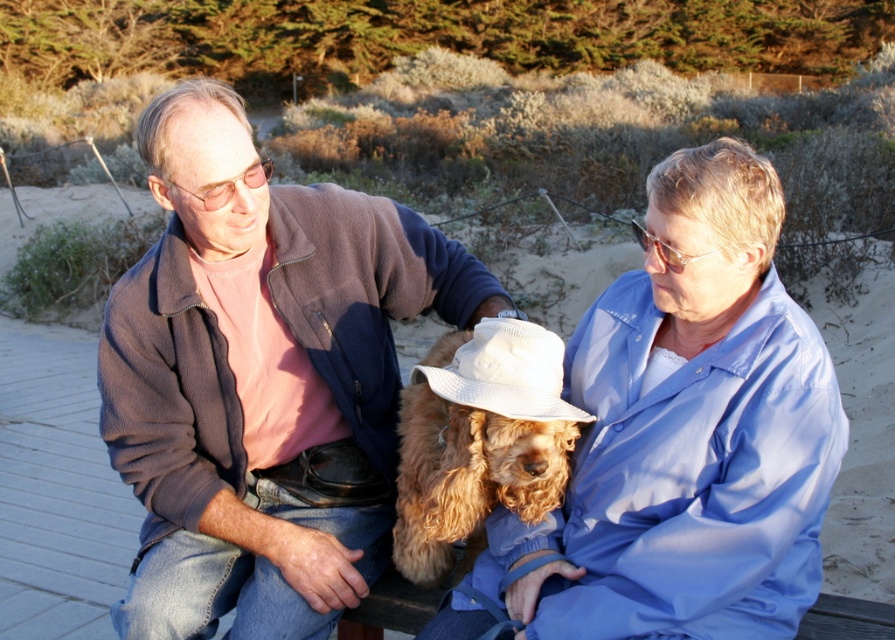
Between point (636, 346) and point (489, 499), which one is positioned in front?

Point (636, 346) is more forward.

Does light blue fabric shirt at center come in front of fuzzy brown dog at center?

Yes, it is in front of fuzzy brown dog at center.

Does point (632, 541) lie in front of point (542, 451)?

No, (632, 541) is behind (542, 451).

I want to click on light blue fabric shirt at center, so click(x=687, y=433).

Who is positioned more to the left, matte brown jacket at left or fuzzy brown dog at center?

From the viewer's perspective, matte brown jacket at left appears more on the left side.

Consider the image. Does matte brown jacket at left have a greater width compared to fuzzy brown dog at center?

Correct, the width of matte brown jacket at left exceeds that of fuzzy brown dog at center.

Who is more forward, (171,608) or (544,339)?

Point (544,339)

Where is `matte brown jacket at left`? Image resolution: width=895 pixels, height=640 pixels. matte brown jacket at left is located at coordinates (261, 380).

Does matte brown jacket at left appear under light blue fabric shirt at center?

Incorrect, matte brown jacket at left is not positioned below light blue fabric shirt at center.

From the picture: Is matte brown jacket at left thinner than light blue fabric shirt at center?

No, matte brown jacket at left is not thinner than light blue fabric shirt at center.

Is point (382, 324) positioned after point (797, 420)?

Yes, it is behind point (797, 420).

Where is `matte brown jacket at left`? The height and width of the screenshot is (640, 895). matte brown jacket at left is located at coordinates (261, 380).